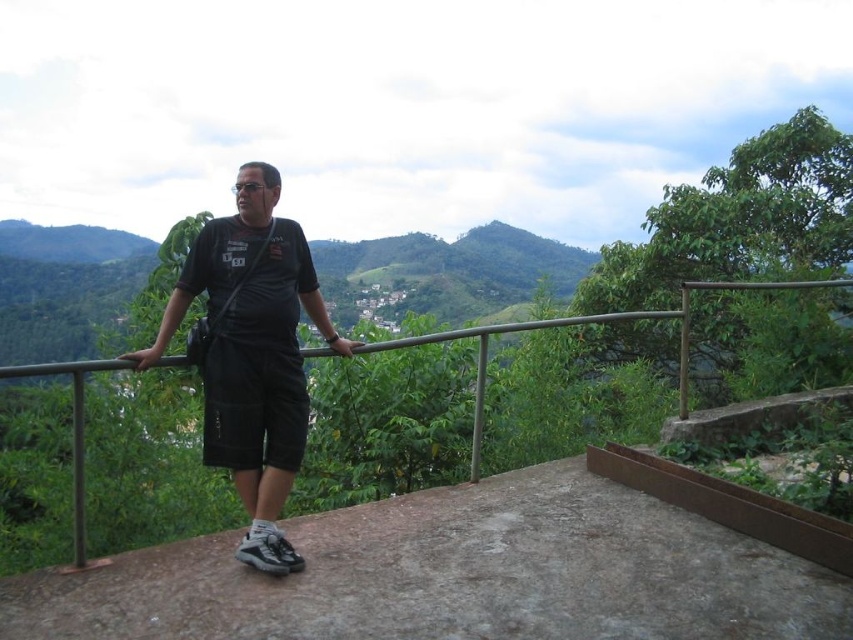
Can you confirm if matte black shirt at center is positioned below metal/rustic rail at center?

Actually, matte black shirt at center is above metal/rustic rail at center.

Image resolution: width=853 pixels, height=640 pixels. Describe the element at coordinates (252, 353) in the screenshot. I see `matte black shirt at center` at that location.

The image size is (853, 640). I want to click on matte black shirt at center, so click(252, 353).